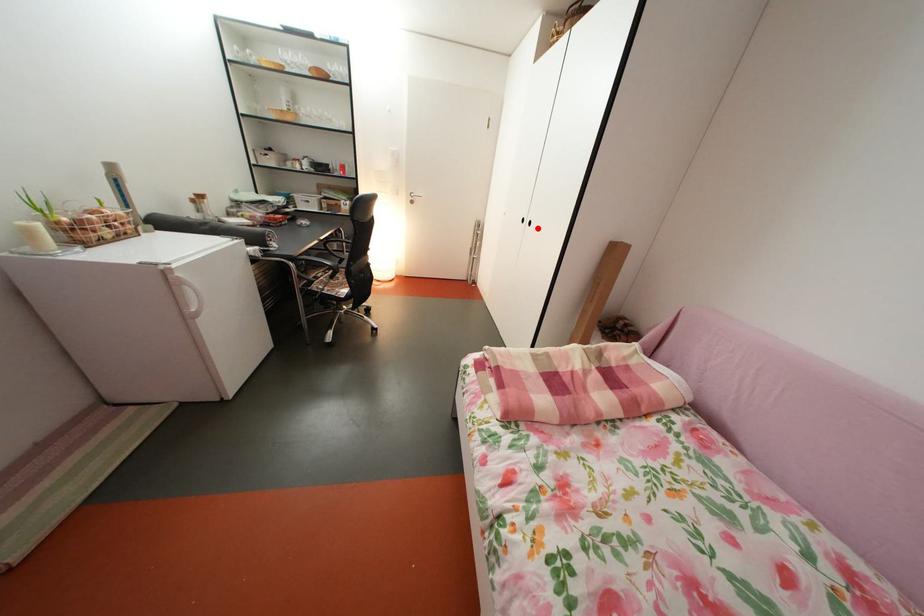
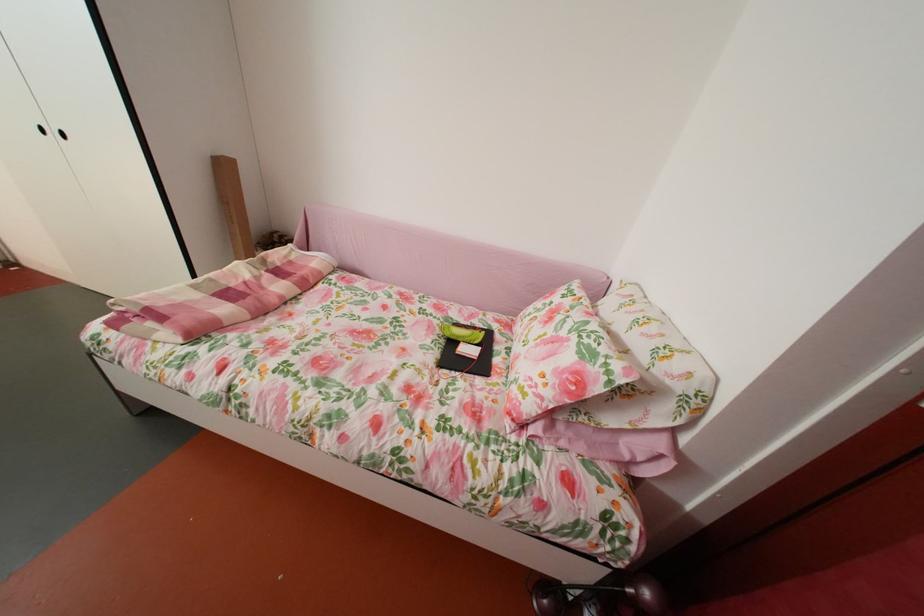
Where in the second image is the point corresponding to the highlighted location from the first image?

(65, 139)